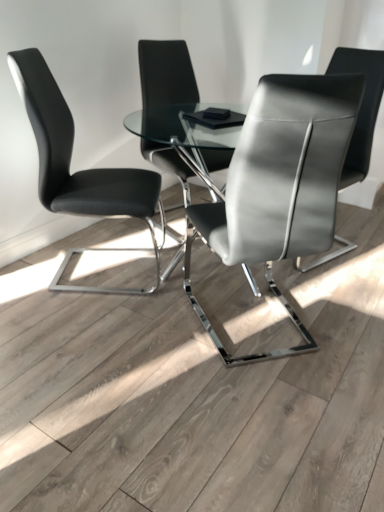
Question: In the image, is black leather chair at left, which is counted as the 1th chair, starting from the left, positioned in front of or behind satin black chair at center, the 4th chair positioned from the left?

Choices:
 (A) front
 (B) behind

Answer: (A)

Question: Is black leather chair at left, which appears as the fourth chair when viewed from the right, situated inside satin black chair at center, the 4th chair positioned from the left, or outside?

Choices:
 (A) outside
 (B) inside

Answer: (A)

Question: Estimate the real-world distances between objects in this image. Which object is farther from the black leather chair at left, which is counted as the 1th chair, starting from the left?

Choices:
 (A) satin gray leather chair at center, placed as the 3th chair when sorted from left to right
 (B) matte black chair at center, the second chair positioned from the left
 (C) satin black chair at center, the 4th chair positioned from the left

Answer: (C)

Question: Estimate the real-world distances between objects in this image. Which object is farther from the matte black chair at center, arranged as the third chair when viewed from the right?

Choices:
 (A) satin gray leather chair at center, placed as the 3th chair when sorted from left to right
 (B) satin black chair at center, the 4th chair positioned from the left
 (C) black leather chair at left, which appears as the fourth chair when viewed from the right

Answer: (A)